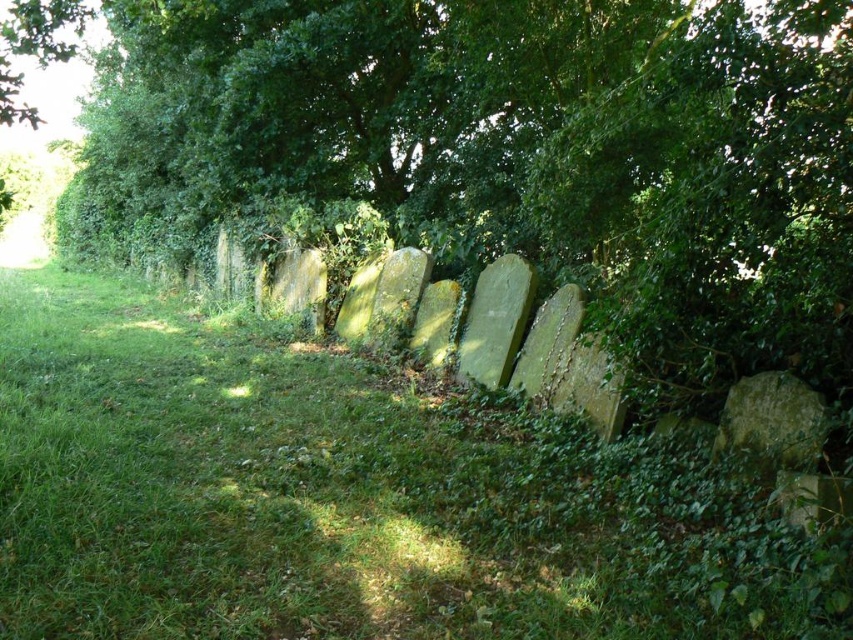
Question: Among these points, which one is farthest from the camera?

Choices:
 (A) (210, 4)
 (B) (248, 412)

Answer: (A)

Question: Is green grassy at center further to the viewer compared to green leafy tree at center?

Choices:
 (A) yes
 (B) no

Answer: (B)

Question: Which point is closer to the camera?

Choices:
 (A) green grassy at center
 (B) green leafy tree at center

Answer: (A)

Question: Is green grassy at center above green leafy tree at center?

Choices:
 (A) no
 (B) yes

Answer: (A)

Question: Can you confirm if green grassy at center is smaller than green leafy tree at center?

Choices:
 (A) no
 (B) yes

Answer: (B)